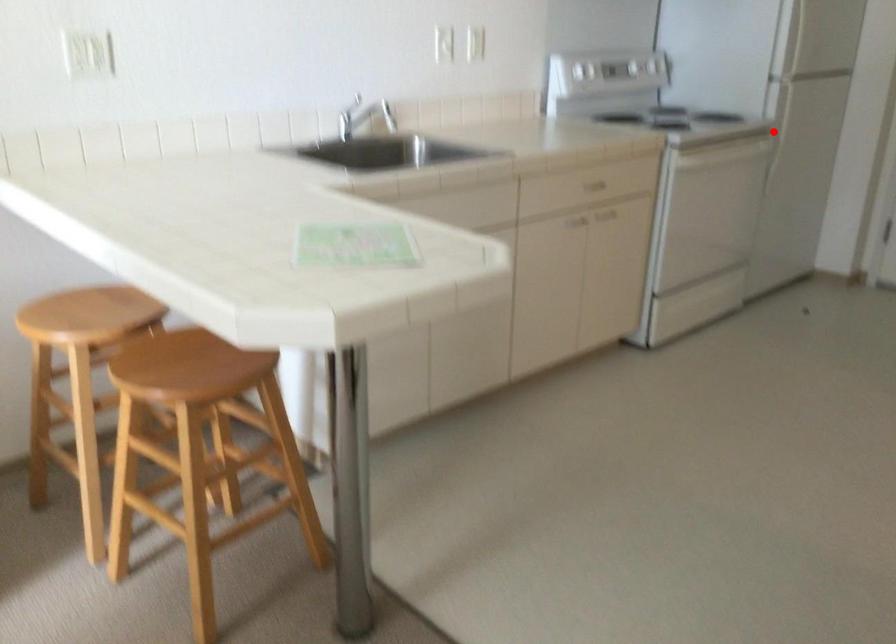
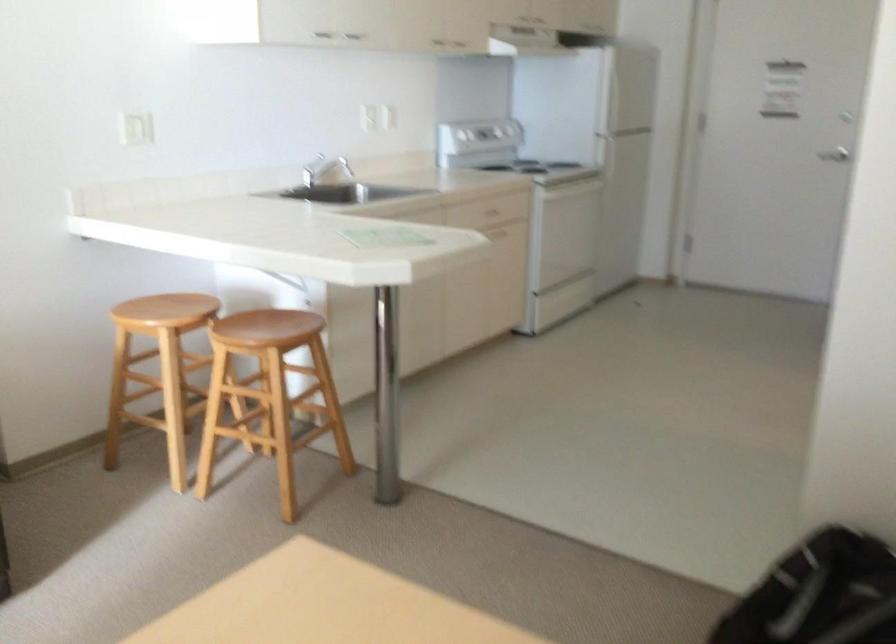
Question: I am providing you with two images of the same scene from different viewpoints. Image1 has a red point marked. In image2, the corresponding 3D location appears at what relative position? Reply with the corresponding letter.

Choices:
 (A) Closer
 (B) Farther

Answer: (B)